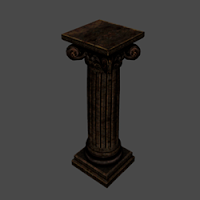
Where is `corner`? This screenshot has width=200, height=200. corner is located at coordinates (106, 175), (106, 185), (134, 158), (72, 160), (62, 34), (108, 49), (143, 32), (98, 19).